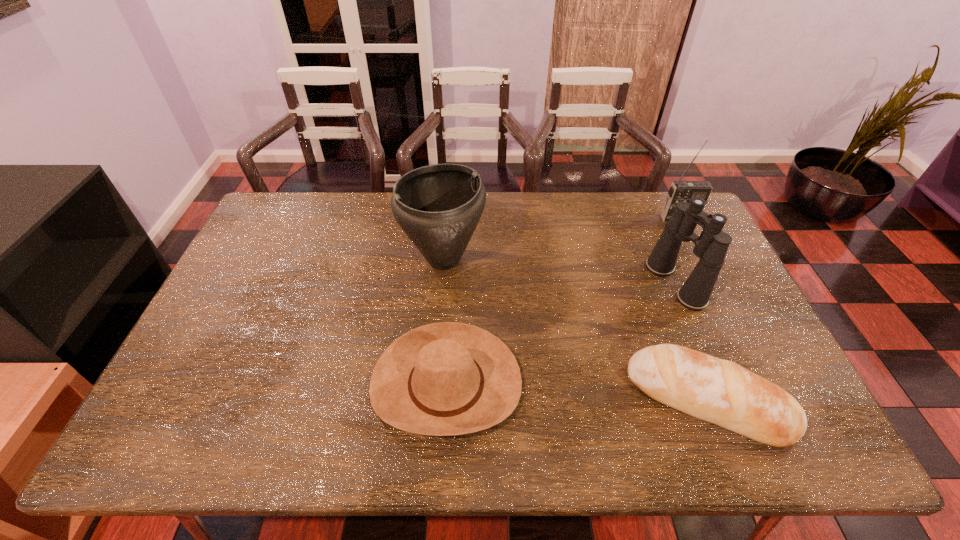
The width and height of the screenshot is (960, 540). I want to click on free space between the urn and the radio receiver, so click(x=562, y=239).

Point out which object is positioned as the third nearest to the cowboy hat. Please provide its 2D coordinates. Your answer should be formatted as a tuple, i.e. [(x, y)], where the tuple contains the x and y coordinates of a point satisfying the conditions above.

[(711, 246)]

The image size is (960, 540). What are the coordinates of `the second closest object to the farthest object` in the screenshot? It's located at (718, 391).

This screenshot has height=540, width=960. I want to click on vacant space that satisfies the following two spatial constraints: 1. on the front side of the urn; 2. on the right side of the bread, so click(x=432, y=400).